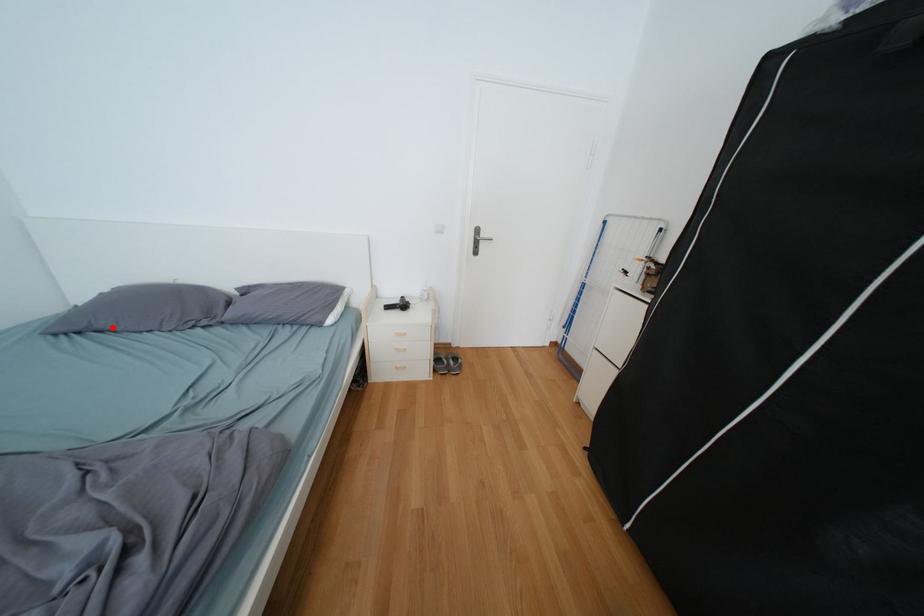
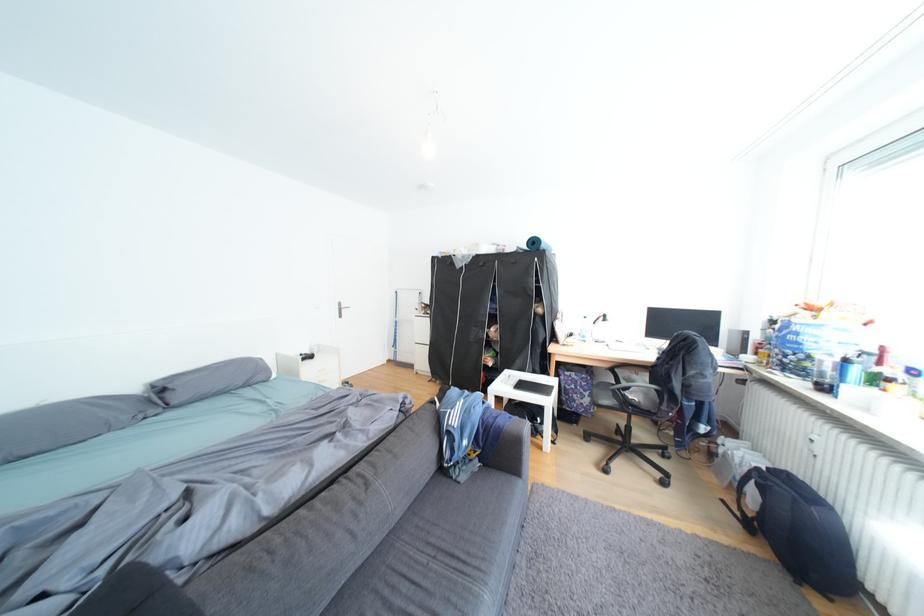
Question: I am providing you with two images of the same scene from different viewpoints. Image1 has a red point marked. In image2, the corresponding 3D location appears at what relative position? Reply with the corresponding letter.

Choices:
 (A) Closer
 (B) Farther

Answer: (A)